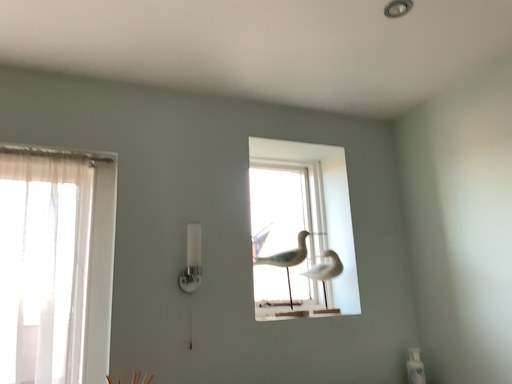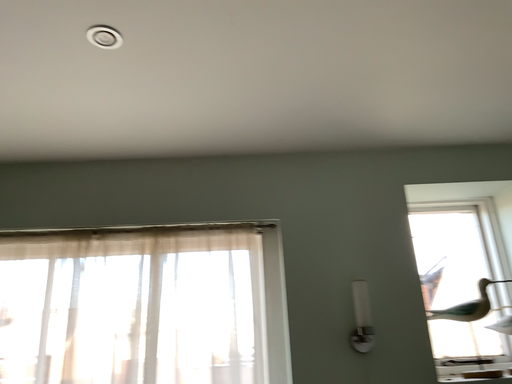
Question: Which way did the camera rotate in the video?

Choices:
 (A) rotated right
 (B) rotated left

Answer: (B)